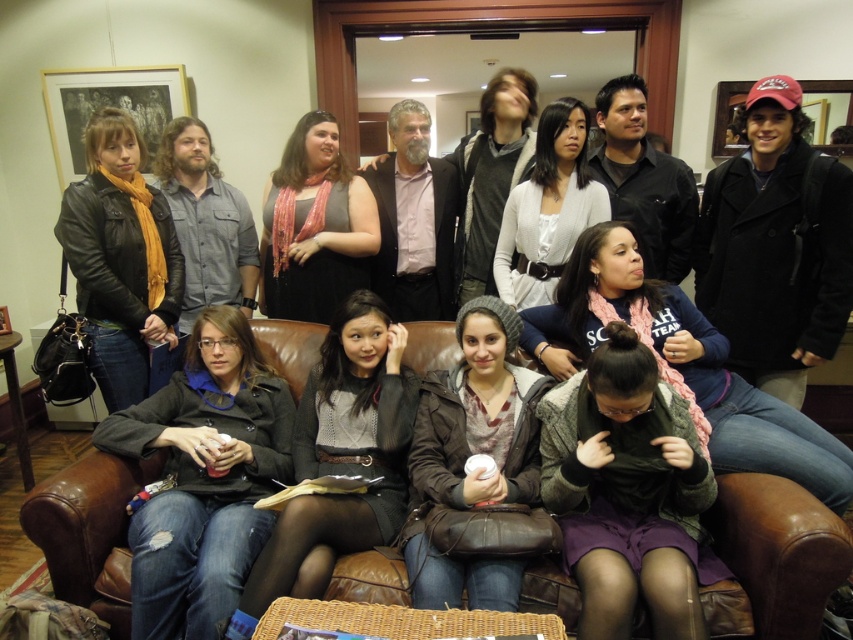
Question: Which point is closer to the camera taking this photo?

Choices:
 (A) (376, 332)
 (B) (701, 401)
 (C) (264, 333)

Answer: (B)

Question: Is brown leather couch at lower center below leather jacket at left?

Choices:
 (A) yes
 (B) no

Answer: (A)

Question: Does pink scarf at center appear on the left side of knitted gray beanie at center?

Choices:
 (A) no
 (B) yes

Answer: (A)

Question: Which object appears farthest from the camera in this image?

Choices:
 (A) denim jacket at lower left
 (B) leather jacket at left
 (C) pink scarf at center

Answer: (B)

Question: Where is knitted gray beanie at center located in relation to white matte cardigan at center in the image?

Choices:
 (A) left
 (B) right

Answer: (A)

Question: Which point is farther from the camera taking this photo?

Choices:
 (A) (99, 435)
 (B) (335, 288)
 (C) (137, 236)

Answer: (B)